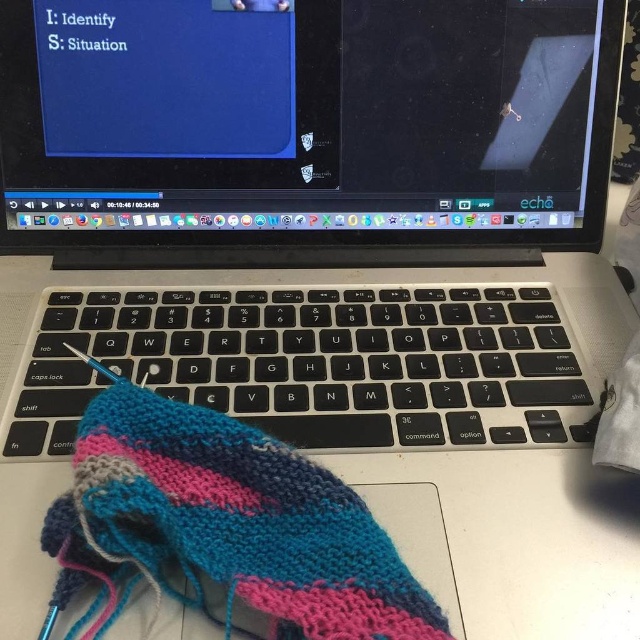
You are trying to place the knitted woolen sock at lower left on top of the black matte keyboard at center. Based on their sizes, will the sock fit entirely on the keyboard without hanging off the edges?

The black matte keyboard at center is wider than the knitted woolen sock at lower left, so the sock will fit entirely on the keyboard without any part hanging off the edges.

You are a student trying to type on the black matte keyboard at center while the knitted woolen sock at lower left is on the laptop. Will the sock interfere with your typing?

The black matte keyboard at center is above the knitted woolen sock at lower left, so the sock is positioned below the keyboard and should not interfere with typing.

Based on the photo, you are setting up a workspace and need to place the satin black laptop at center and the black matte keyboard at center on a desk. Given their sizes, which object should be placed first to ensure both fit properly?

The satin black laptop at center is much taller than the black matte keyboard at center. Therefore, place the satin black laptop at center first to ensure there is enough space for the keyboard underneath or beside it.